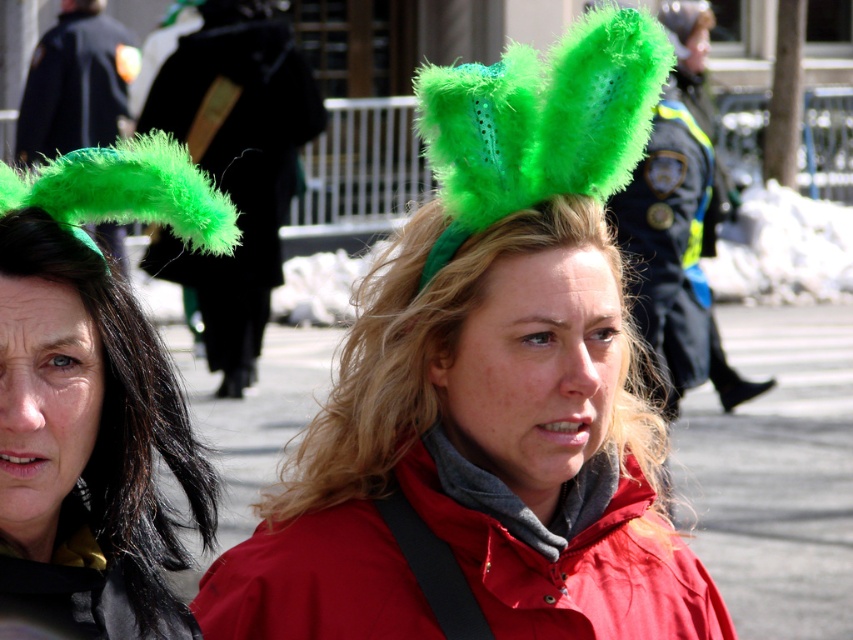
Question: Among these points, which one is farthest from the camera?

Choices:
 (A) (282, 577)
 (B) (73, 536)
 (C) (610, 180)
 (D) (357, 561)

Answer: (D)

Question: Is green fuzzy ears at center in front of black fabric jacket at upper left?

Choices:
 (A) yes
 (B) no

Answer: (A)

Question: From the image, what is the correct spatial relationship of green fuzzy hat at upper left in relation to green fuzzy jacket at left?

Choices:
 (A) below
 (B) above

Answer: (A)

Question: Among these points, which one is farthest from the camera?

Choices:
 (A) (474, 224)
 (B) (144, 506)

Answer: (A)

Question: Which point appears closest to the camera in this image?

Choices:
 (A) (65, 625)
 (B) (524, 141)
 (C) (299, 522)

Answer: (A)

Question: Is fuzzy green headband at center positioned behind green fuzzy ears at center?

Choices:
 (A) yes
 (B) no

Answer: (B)